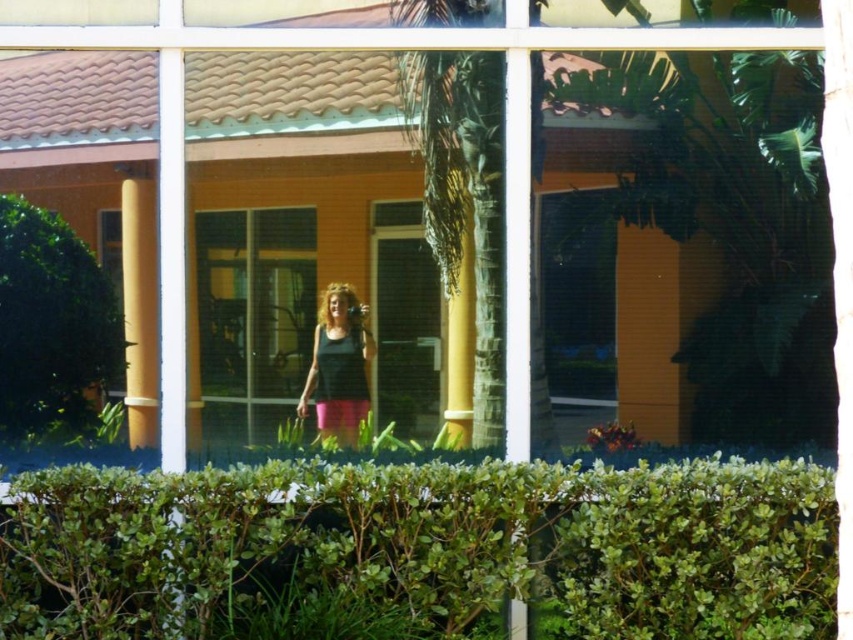
You are standing outside the building and looking through the window. You see a green leafy bush at left and a black matte tank top at center. Which object is closer to the left edge of the window?

The green leafy bush at left is closer to the left edge of the window because it is positioned on the left side of the black matte tank top at center.

You are standing outside the building and looking through the window. You see the green leafy hedge at lower center and the green leafy bush at left. Which one is closer to the bottom edge of the window?

The green leafy hedge at lower center is closer to the bottom edge of the window because it is located below the green leafy bush at left.